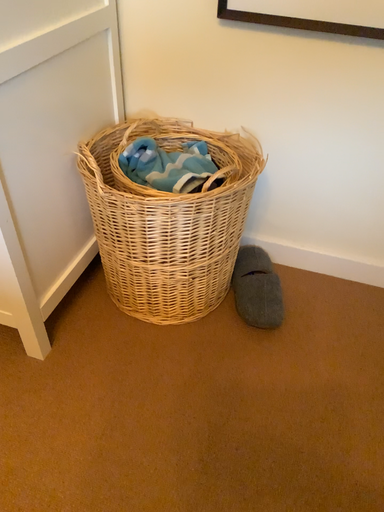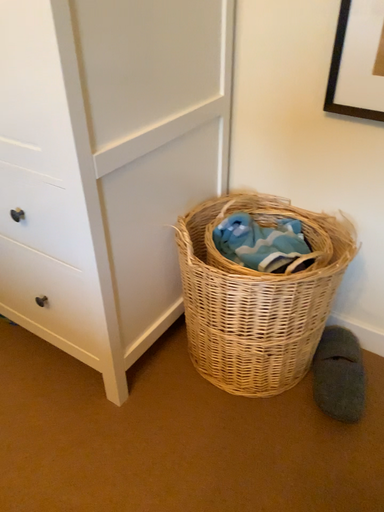
Question: How did the camera likely rotate when shooting the video?

Choices:
 (A) rotated downward
 (B) rotated upward

Answer: (B)